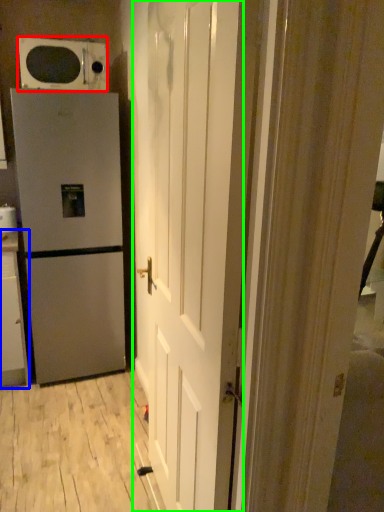
Question: Which is nearer to the microwave oven (highlighted by a red box)? cabinetry (highlighted by a blue box) or door (highlighted by a green box).

Choices:
 (A) cabinetry
 (B) door

Answer: (A)